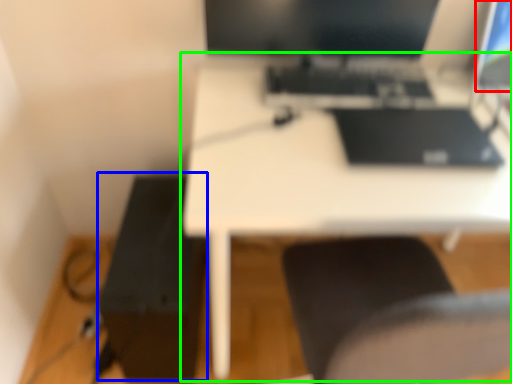
Question: Considering the real-world distances, which object is farthest from computer screen (highlighted by a red box)? printer (highlighted by a blue box) or table (highlighted by a green box)?

Choices:
 (A) printer
 (B) table

Answer: (A)